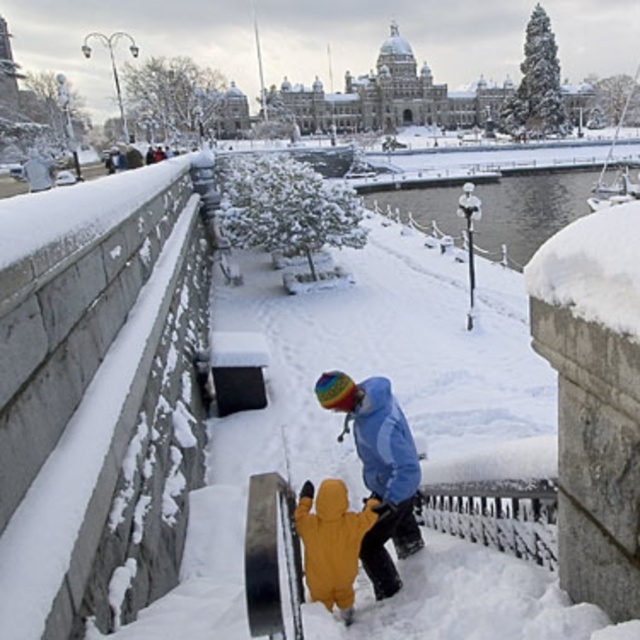
Between yellow fleece jacket at center and yellow fuzzy snowsuit at center, which one appears on the right side from the viewer's perspective?

Positioned to the right is yellow fleece jacket at center.

Who is taller, yellow fleece jacket at center or yellow fuzzy snowsuit at center?

Standing taller between the two is yellow fleece jacket at center.

Is point (401, 529) positioned before point (358, 547)?

No, (401, 529) is behind (358, 547).

The height and width of the screenshot is (640, 640). In order to click on yellow fleece jacket at center in this screenshot , I will do `click(380, 468)`.

Does yellow fuzzy snowsuit at center have a greater height compared to matte blue jacket at center?

Indeed, yellow fuzzy snowsuit at center has a greater height compared to matte blue jacket at center.

This screenshot has width=640, height=640. I want to click on yellow fuzzy snowsuit at center, so click(332, 541).

Does yellow fleece jacket at center appear on the left side of matte blue jacket at center?

Yes, yellow fleece jacket at center is to the left of matte blue jacket at center.

Is yellow fleece jacket at center thinner than matte blue jacket at center?

In fact, yellow fleece jacket at center might be wider than matte blue jacket at center.

Is point (390, 518) more distant than point (356, 388)?

No, (390, 518) is closer to viewer.

Where is `yellow fleece jacket at center`? The height and width of the screenshot is (640, 640). yellow fleece jacket at center is located at coordinates (380, 468).